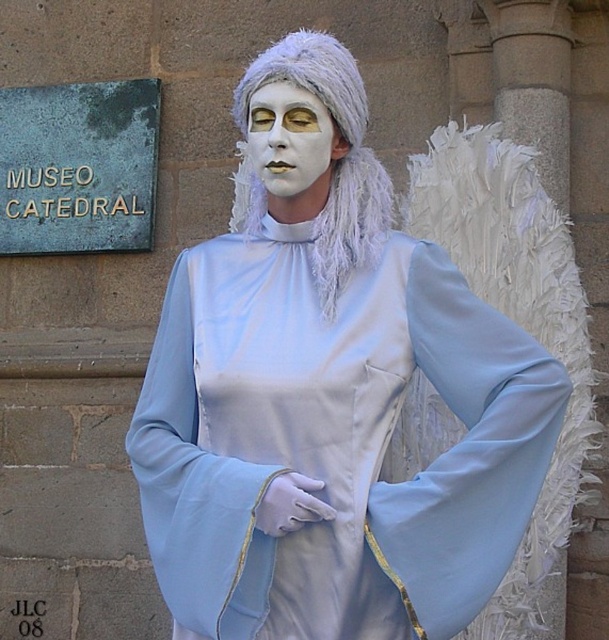
Between point (359, 195) and point (319, 156), which one is positioned behind?

Point (359, 195)

Does point (241, 129) lie in front of point (269, 177)?

No, (241, 129) is behind (269, 177).

Is point (364, 250) positioned before point (269, 177)?

No, (364, 250) is behind (269, 177).

At what (x,y) coordinates should I click in order to perform the action: click on white fluffy wig at center. Please return your answer as a coordinate pair (x, y). Looking at the image, I should click on click(337, 161).

Who is taller, satin blue angel at center or white fluffy wig at center?

Standing taller between the two is satin blue angel at center.

Is point (384, 416) more distant than point (276, 65)?

No.

Image resolution: width=609 pixels, height=640 pixels. In order to click on satin blue angel at center in this screenshot , I will do `click(331, 408)`.

At what (x,y) coordinates should I click in order to perform the action: click on satin blue angel at center. Please return your answer as a coordinate pair (x, y). This screenshot has height=640, width=609. Looking at the image, I should click on point(331,408).

This screenshot has height=640, width=609. Describe the element at coordinates (331, 408) in the screenshot. I see `satin blue angel at center` at that location.

This screenshot has height=640, width=609. I want to click on satin blue angel at center, so click(331, 408).

What are the coordinates of `satin blue angel at center` in the screenshot? It's located at (331, 408).